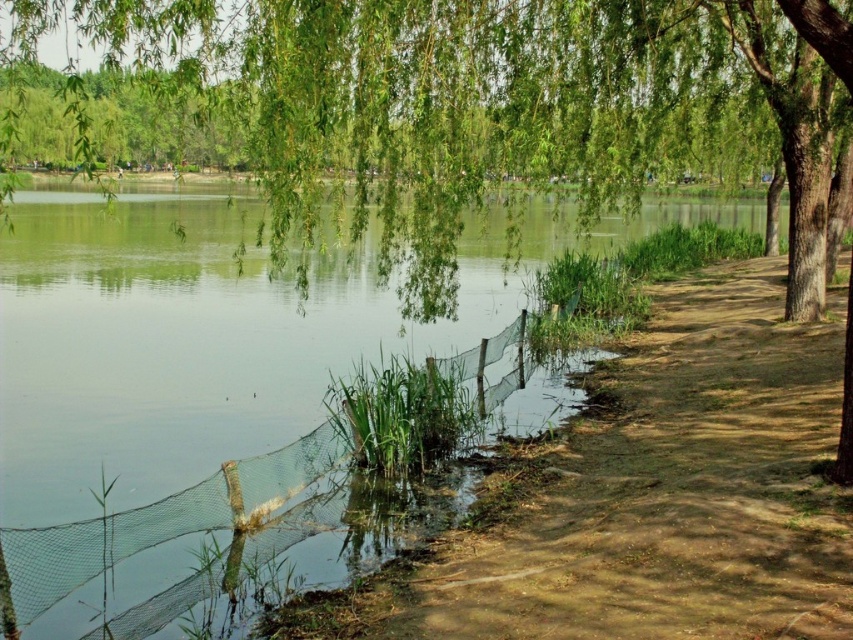
Question: Does green leafy willow at upper center come behind transparent mesh net at lower center?

Choices:
 (A) yes
 (B) no

Answer: (B)

Question: Estimate the real-world distances between objects in this image. Which object is farther from the green leafy willow at upper center?

Choices:
 (A) brown dirt path at lower right
 (B) transparent mesh net at lower center

Answer: (B)

Question: Which object is positioned closest to the transparent mesh net at lower center?

Choices:
 (A) brown dirt path at lower right
 (B) green leafy willow at upper center

Answer: (A)

Question: Does green leafy willow at upper center appear on the right side of brown dirt path at lower right?

Choices:
 (A) yes
 (B) no

Answer: (B)

Question: Does green leafy willow at upper center appear on the right side of transparent mesh net at lower center?

Choices:
 (A) yes
 (B) no

Answer: (A)

Question: Which point appears farthest from the camera in this image?

Choices:
 (A) (657, 368)
 (B) (820, 97)

Answer: (A)